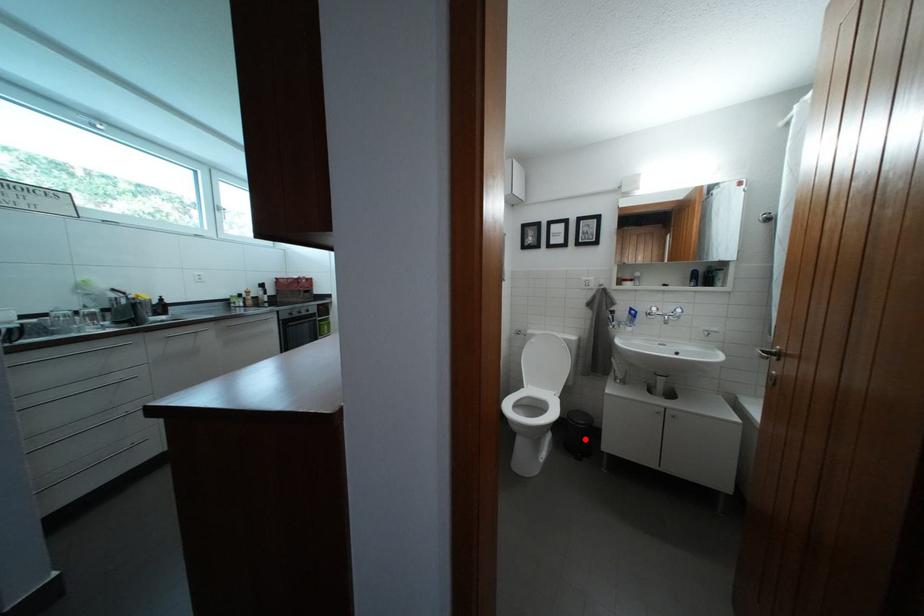
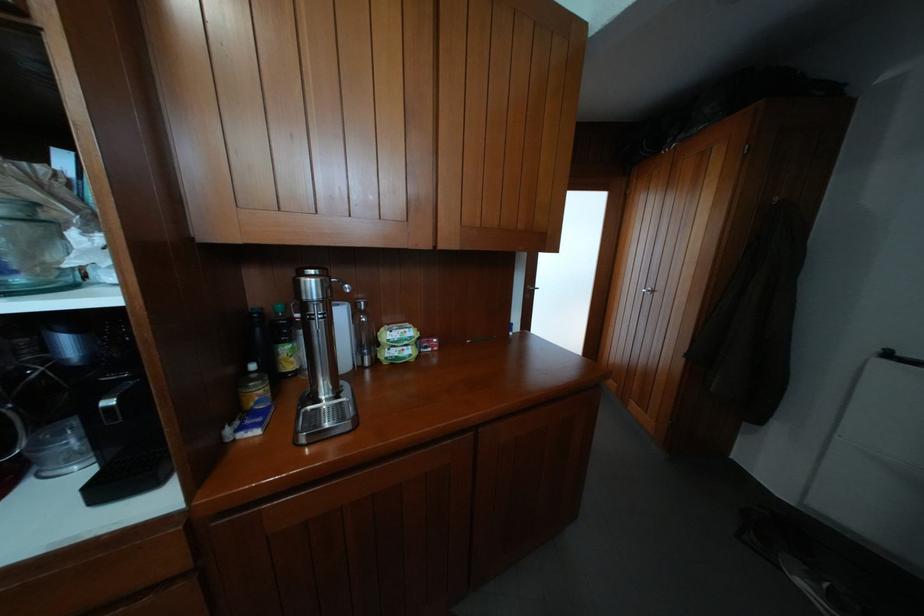
Question: I am providing you with two images of the same scene from different viewpoints. A red point is marked on the first image. At the location where the point appears in image 1, is it still visible in image 2?

Choices:
 (A) Yes
 (B) No

Answer: (B)